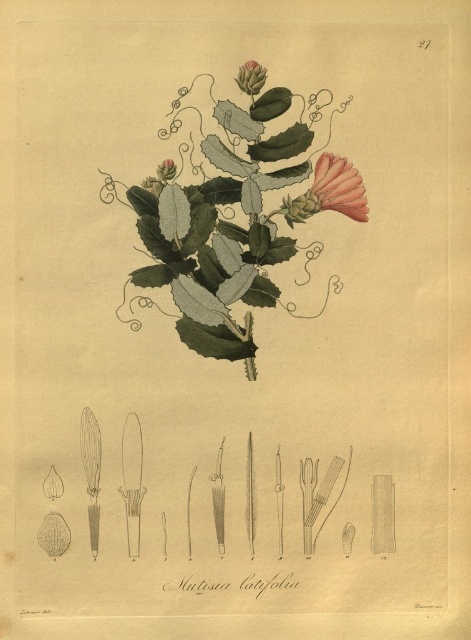
You are a botanist examining the botanical illustration of Mutisia catifolia. You notice the green glossy leaves at center and the green matte flower at upper center. Which object is located to the left of the other?

The green glossy leaves at center is positioned on the left side of green matte flower at upper center.

You are examining a botanical illustration of Mutisia catifolia. You notice a green matte flower at upper center and a green matte leaf at upper center. Which of these two elements is positioned in front of the other?

The green matte flower at upper center is closer to the viewer than the green matte leaf at upper center, so it is positioned in front of the leaf.